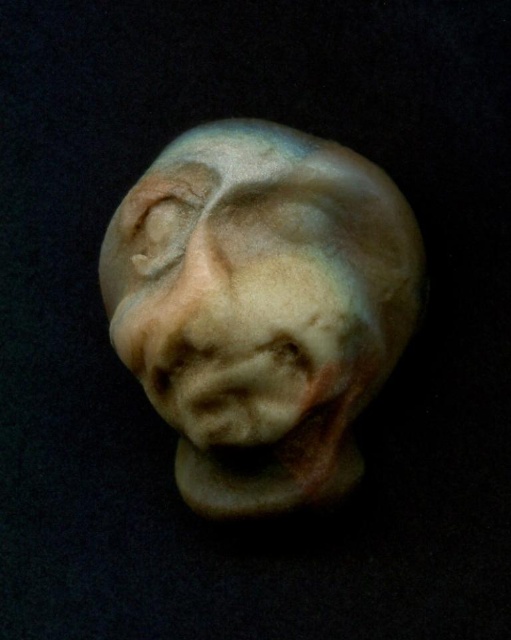
You are an art restorer examining the matte clay sculpture at center and the matte clay nose at center. Based on their dimensions, which object is more likely to require a larger workspace for restoration?

The matte clay sculpture at center is wider than the matte clay nose at center, so it would require a larger workspace for restoration.

You are standing in front of the sculpture and want to place a small sticker exactly at the point labeled point [171,355]. If the sticker is 2 centimeters in diameter, will it fit without overlapping any other parts of the sculpture?

The point labeled point [171,355] is 1.22 meters from the camera. Since the sticker is only 2 centimeters in diameter, it will fit at that location without overlapping any other parts of the sculpture.